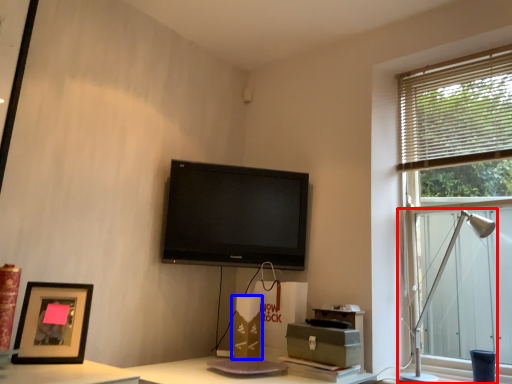
Question: Which of the following is the closest to the observer, table lamp (highlighted by a red box) or cardboard box (highlighted by a blue box)?

Choices:
 (A) table lamp
 (B) cardboard box

Answer: (A)